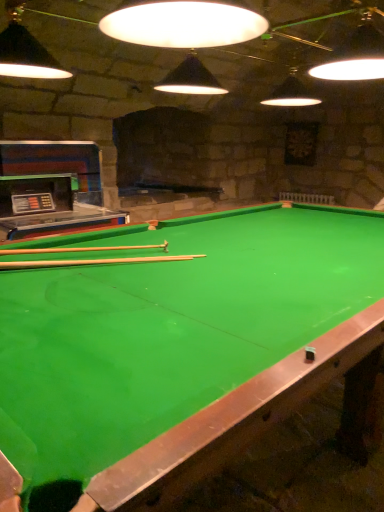
Question: Can you confirm if green felt billiard table at center is shorter than wooden cue at center, arranged as the 1th cue when ordered from the bottom?

Choices:
 (A) no
 (B) yes

Answer: (A)

Question: Does green felt billiard table at center turn towards wooden cue at center, arranged as the 1th cue when ordered from the bottom?

Choices:
 (A) no
 (B) yes

Answer: (A)

Question: Is green felt billiard table at center completely or partially outside of wooden cue at center, arranged as the 1th cue when ordered from the bottom?

Choices:
 (A) yes
 (B) no

Answer: (A)

Question: From a real-world perspective, is green felt billiard table at center on wooden cue at center, arranged as the 1th cue when ordered from the bottom?

Choices:
 (A) no
 (B) yes

Answer: (A)

Question: Considering the relative sizes of green felt billiard table at center and wooden cue at center, which is the second cue in top-to-bottom order, in the image provided, is green felt billiard table at center thinner than wooden cue at center, which is the second cue in top-to-bottom order,?

Choices:
 (A) no
 (B) yes

Answer: (A)

Question: Is green felt billiard table at center situated inside wooden cue at center, arranged as the 1th cue when ordered from the bottom, or outside?

Choices:
 (A) outside
 (B) inside

Answer: (A)

Question: In the image, is green felt billiard table at center positioned in front of or behind wooden cue at center, arranged as the 1th cue when ordered from the bottom?

Choices:
 (A) front
 (B) behind

Answer: (A)

Question: Based on their sizes in the image, would you say green felt billiard table at center is bigger or smaller than wooden cue at center, which is the second cue in top-to-bottom order?

Choices:
 (A) big
 (B) small

Answer: (A)

Question: From a real-world perspective, is green felt billiard table at center above or below wooden cue at center, which is the second cue in top-to-bottom order?

Choices:
 (A) above
 (B) below

Answer: (B)

Question: From a real-world perspective, relative to wooden cue at center, arranged as the 1th cue when ordered from the bottom, is wooden cue at center, positioned as the second cue in bottom-to-top order, vertically above or below?

Choices:
 (A) above
 (B) below

Answer: (A)

Question: Is wooden cue at center, which is the first cue from top to bottom, bigger or smaller than wooden cue at center, arranged as the 1th cue when ordered from the bottom?

Choices:
 (A) big
 (B) small

Answer: (A)

Question: Is wooden cue at center, positioned as the second cue in bottom-to-top order, taller or shorter than wooden cue at center, arranged as the 1th cue when ordered from the bottom?

Choices:
 (A) short
 (B) tall

Answer: (B)

Question: Which is correct: wooden cue at center, positioned as the second cue in bottom-to-top order, is inside wooden cue at center, arranged as the 1th cue when ordered from the bottom, or outside of it?

Choices:
 (A) outside
 (B) inside

Answer: (A)

Question: Is wooden cue at center, which is the second cue in top-to-bottom order, taller or shorter than wooden cue at center, which is the first cue from top to bottom?

Choices:
 (A) short
 (B) tall

Answer: (A)

Question: Considering the positions of wooden cue at center, which is the second cue in top-to-bottom order, and wooden cue at center, which is the first cue from top to bottom, in the image, is wooden cue at center, which is the second cue in top-to-bottom order, wider or thinner than wooden cue at center, which is the first cue from top to bottom,?

Choices:
 (A) wide
 (B) thin

Answer: (A)